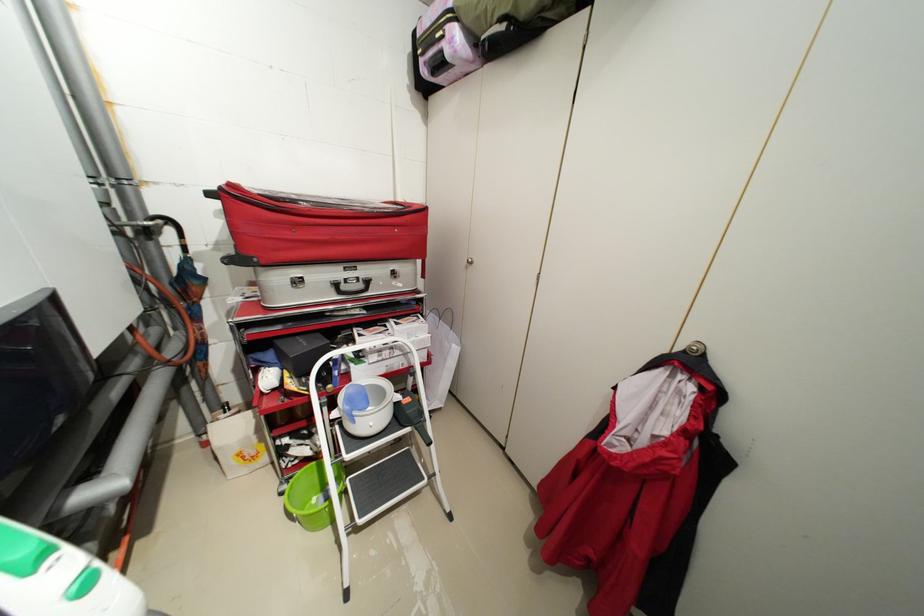
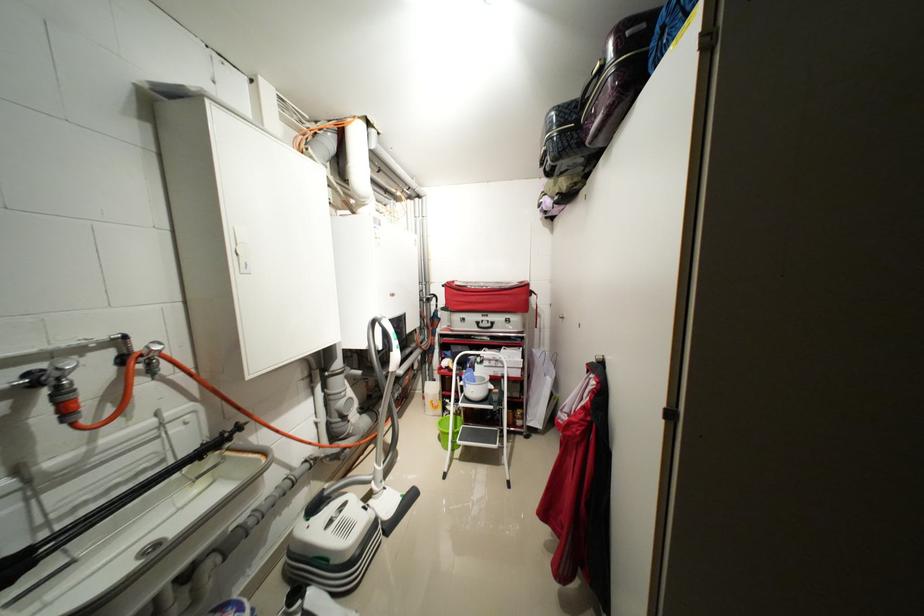
Where in the second image is the point corresponding to (x=237, y=185) from the first image?

(455, 284)